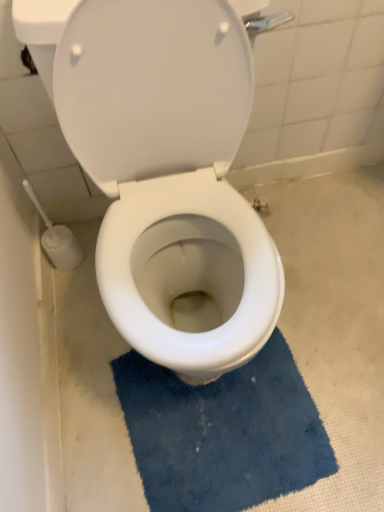
Question: From a real-world perspective, is blue textured bath mat at lower center located beneath white plastic toilet brush at lower left?

Choices:
 (A) no
 (B) yes

Answer: (B)

Question: From the image's perspective, would you say blue textured bath mat at lower center is positioned over white plastic toilet brush at lower left?

Choices:
 (A) no
 (B) yes

Answer: (A)

Question: Does blue textured bath mat at lower center contain white plastic toilet brush at lower left?

Choices:
 (A) no
 (B) yes

Answer: (A)

Question: Does blue textured bath mat at lower center lie in front of white plastic toilet brush at lower left?

Choices:
 (A) no
 (B) yes

Answer: (B)

Question: Does blue textured bath mat at lower center have a lesser height compared to white plastic toilet brush at lower left?

Choices:
 (A) no
 (B) yes

Answer: (B)

Question: Is blue textured bath mat at lower center to the left of white plastic toilet brush at lower left from the viewer's perspective?

Choices:
 (A) yes
 (B) no

Answer: (B)

Question: From a real-world perspective, is white plastic toilet brush at lower left beneath blue textured bath mat at lower center?

Choices:
 (A) yes
 (B) no

Answer: (B)

Question: Can you confirm if white plastic toilet brush at lower left is shorter than blue textured bath mat at lower center?

Choices:
 (A) yes
 (B) no

Answer: (B)

Question: Are white plastic toilet brush at lower left and blue textured bath mat at lower center beside each other?

Choices:
 (A) yes
 (B) no

Answer: (B)

Question: Can you confirm if white plastic toilet brush at lower left is thinner than blue textured bath mat at lower center?

Choices:
 (A) no
 (B) yes

Answer: (B)

Question: Are white plastic toilet brush at lower left and blue textured bath mat at lower center far apart?

Choices:
 (A) no
 (B) yes

Answer: (A)

Question: Is white plastic toilet brush at lower left outside of blue textured bath mat at lower center?

Choices:
 (A) no
 (B) yes

Answer: (B)

Question: Is blue textured bath mat at lower center positioned with its back to white glossy toilet at center?

Choices:
 (A) yes
 (B) no

Answer: (B)